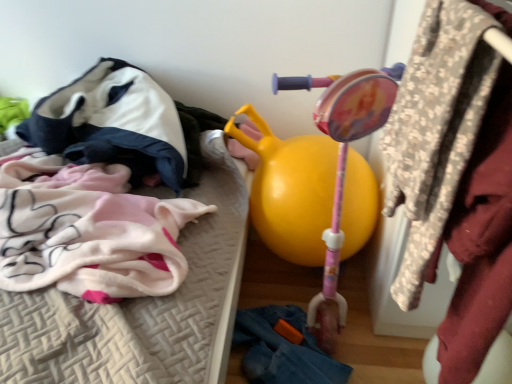
Question: Can you confirm if denim at lower right, arranged as the second clothing when viewed from the left, is positioned to the left of floral fabric coat at upper right?

Choices:
 (A) yes
 (B) no

Answer: (A)

Question: From the image's perspective, is denim at lower right, placed as the 1th clothing when sorted from bottom to top, under floral fabric coat at upper right?

Choices:
 (A) no
 (B) yes

Answer: (B)

Question: Can you confirm if denim at lower right, placed as the 1th clothing when sorted from bottom to top, is shorter than floral fabric coat at upper right?

Choices:
 (A) yes
 (B) no

Answer: (A)

Question: Would you say floral fabric coat at upper right is part of denim at lower right, which is the second clothing from top to bottom,'s contents?

Choices:
 (A) yes
 (B) no

Answer: (B)

Question: Is denim at lower right, which is the second clothing from top to bottom, further to camera compared to floral fabric coat at upper right?

Choices:
 (A) yes
 (B) no

Answer: (A)

Question: Could you tell me if denim at lower right, placed as the 1th clothing when sorted from bottom to top, is facing floral fabric coat at upper right?

Choices:
 (A) no
 (B) yes

Answer: (A)

Question: Is velvet-like hoodie at upper left, the 2th clothing from the bottom, to the left of denim at lower right, arranged as the second clothing when viewed from the left, from the viewer's perspective?

Choices:
 (A) no
 (B) yes

Answer: (B)

Question: Is velvet-like hoodie at upper left, which appears as the 1th clothing when viewed from the top, facing towards denim at lower right, which is the second clothing from top to bottom?

Choices:
 (A) yes
 (B) no

Answer: (B)

Question: Is there a large distance between velvet-like hoodie at upper left, arranged as the second clothing when viewed from the right, and denim at lower right, arranged as the second clothing when viewed from the left?

Choices:
 (A) no
 (B) yes

Answer: (A)

Question: Is velvet-like hoodie at upper left, the 2th clothing from the bottom, further to camera compared to denim at lower right, arranged as the first clothing when viewed from the right?

Choices:
 (A) no
 (B) yes

Answer: (A)

Question: Is velvet-like hoodie at upper left, the first clothing viewed from the left, taller than denim at lower right, placed as the 1th clothing when sorted from bottom to top?

Choices:
 (A) yes
 (B) no

Answer: (A)

Question: Is velvet-like hoodie at upper left, the first clothing viewed from the left, turned away from denim at lower right, placed as the 1th clothing when sorted from bottom to top?

Choices:
 (A) no
 (B) yes

Answer: (A)

Question: Is floral fabric coat at upper right further to camera compared to denim at lower right, placed as the 1th clothing when sorted from bottom to top?

Choices:
 (A) no
 (B) yes

Answer: (A)